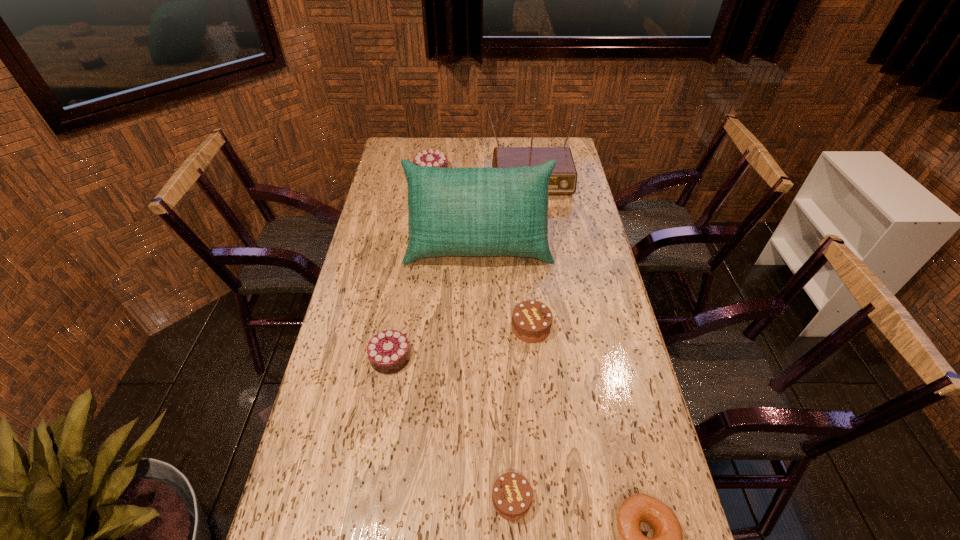
You are a GUI agent. You are given a task and a screenshot of the screen. Output one action in this format:
    pyautogui.click(x=<x>, y=<y>)
    Task: Click on the free space at the right edge of the desktop
    
    Given the screenshot: What is the action you would take?
    pyautogui.click(x=634, y=471)

Locate an element on the screen. The height and width of the screenshot is (540, 960). vacant area that lies between the smaller brown chocolate cake and the cushion is located at coordinates (495, 372).

Locate an element on the screen. vacant space that is in between the radio_receiver and the smaller chocolate chocolate cake is located at coordinates (459, 264).

This screenshot has height=540, width=960. What are the coordinates of `vacant point located between the nearer chocolate chocolate cake and the nearer brown chocolate cake` in the screenshot? It's located at (451, 428).

Locate an element on the screen. This screenshot has width=960, height=540. free space between the bigger chocolate chocolate cake and the nearest chocolate cake is located at coordinates (471, 336).

Find the location of a particular element. This screenshot has width=960, height=540. object that is the second closest one to the smaller brown chocolate cake is located at coordinates (388, 351).

Locate an element on the screen. The width and height of the screenshot is (960, 540). object that is the closest to the radio_receiver is located at coordinates (479, 212).

Find the location of `chocolate cake that is the fourth closest to the third farthest object`. chocolate cake that is the fourth closest to the third farthest object is located at coordinates (512, 494).

The height and width of the screenshot is (540, 960). What are the coordinates of `the closest chocolate cake relative to the bagel` in the screenshot? It's located at (512, 494).

Locate an element on the screen. This screenshot has width=960, height=540. chocolate chocolate cake that stands as the second closest to the smaller brown chocolate cake is located at coordinates (431, 158).